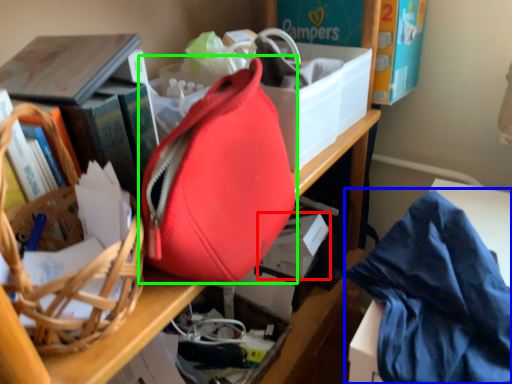
Question: Which is nearer to the storage box (highlighted by a red box)? clothe (highlighted by a blue box) or handbag (highlighted by a green box).

Choices:
 (A) clothe
 (B) handbag

Answer: (A)